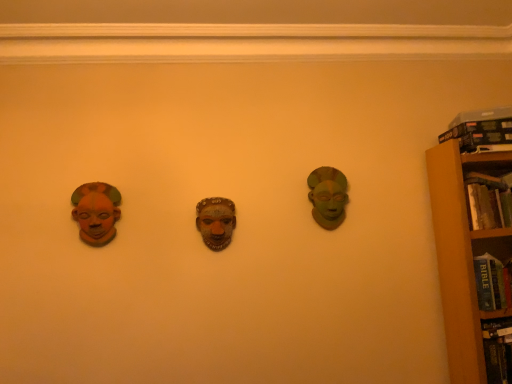
Question: Does matte orange mask at left, acting as the second head starting from the back, have a larger size compared to hardcover book at right, arranged as the 1th book when ordered from the bottom?

Choices:
 (A) no
 (B) yes

Answer: (A)

Question: Is matte orange mask at left, which appears as the first head when viewed from the left, outside hardcover book at right, which is counted as the 2th book, starting from the top?

Choices:
 (A) yes
 (B) no

Answer: (A)

Question: Is matte orange mask at left, the 2th head from the right, to the left of hardcover book at right, arranged as the 1th book when ordered from the bottom, from the viewer's perspective?

Choices:
 (A) no
 (B) yes

Answer: (B)

Question: From the image's perspective, is matte orange mask at left, acting as the second head starting from the back, under hardcover book at right, arranged as the 1th book when ordered from the bottom?

Choices:
 (A) yes
 (B) no

Answer: (A)

Question: Is there a large distance between matte orange mask at left, the first head in the front-to-back sequence, and hardcover book at right, which is counted as the 2th book, starting from the top?

Choices:
 (A) no
 (B) yes

Answer: (B)

Question: Is the depth of matte orange mask at left, acting as the second head starting from the back, less than that of hardcover book at right, which is counted as the 2th book, starting from the top?

Choices:
 (A) yes
 (B) no

Answer: (A)

Question: Is matte orange mask at left, acting as the second head starting from the back, next to brown wooden bookcase at right?

Choices:
 (A) yes
 (B) no

Answer: (B)

Question: Considering the relative positions of matte orange mask at left, the 2th head from the right, and brown wooden bookcase at right in the image provided, is matte orange mask at left, the 2th head from the right, in front of brown wooden bookcase at right?

Choices:
 (A) no
 (B) yes

Answer: (A)

Question: Considering the relative sizes of matte orange mask at left, which appears as the first head when viewed from the left, and brown wooden bookcase at right in the image provided, is matte orange mask at left, which appears as the first head when viewed from the left, smaller than brown wooden bookcase at right?

Choices:
 (A) yes
 (B) no

Answer: (A)

Question: Is matte orange mask at left, the first head in the front-to-back sequence, taller than brown wooden bookcase at right?

Choices:
 (A) no
 (B) yes

Answer: (A)

Question: From the image's perspective, is matte orange mask at left, acting as the second head starting from the back, located beneath brown wooden bookcase at right?

Choices:
 (A) yes
 (B) no

Answer: (B)

Question: From a real-world perspective, is matte orange mask at left, the first head in the front-to-back sequence, on top of brown wooden bookcase at right?

Choices:
 (A) yes
 (B) no

Answer: (A)

Question: From the image's perspective, would you say hardcover book at right, arranged as the 1th book when ordered from the bottom, is positioned over hardcover book at upper right, the first book positioned from the top?

Choices:
 (A) yes
 (B) no

Answer: (B)